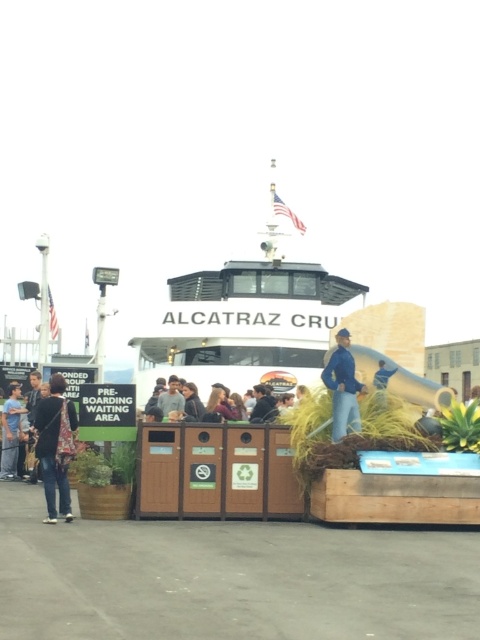
You are standing at the ferry terminal and need to place a new information sign. The sign must be placed in an area that is not occupied by the dark blue jeans at lower left. Where should you place the sign?

The dark blue jeans at lower left is located at point (56,445). To avoid this area, place the sign elsewhere, such as near the PRE BOARDING WAITING AREA or near the ferry boat.

You are a security guard at the ferry terminal. You notice two items left behind by passengers. The dark blue jeans at lower left and the light brown leather jacket at center. According to the scene description, where is the dark blue jeans located relative to the light brown leather jacket?

The dark blue jeans at lower left is above the light brown leather jacket at center.

In the scene shown: You are a passenger at the ferry terminal and see both the blue denim jacket at center and the matte black jacket at center. Which jacket is located to the right when facing the preboarding waiting area?

The blue denim jacket at center is positioned on the right side of matte black jacket at center, so it is located to the right when facing the preboarding waiting area.